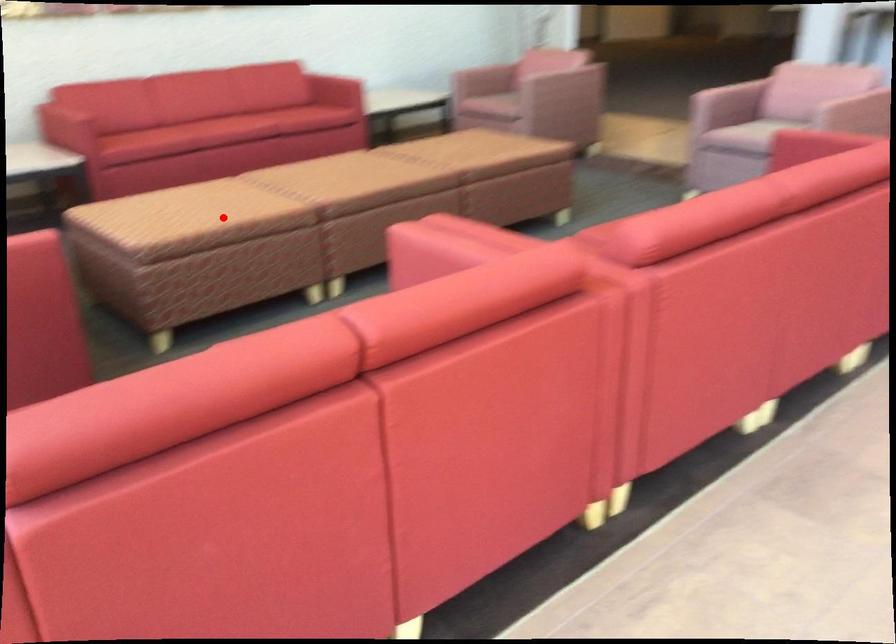
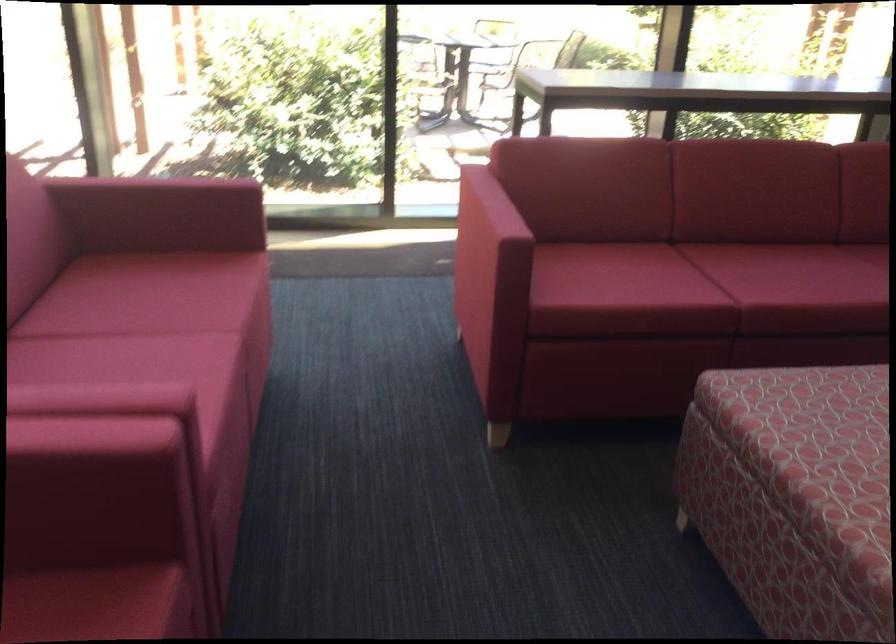
Question: I am providing you with two images of the same scene from different viewpoints. A red point is shown in image1. For the corresponding object point in image2, is it positioned nearer or farther from the camera?

Choices:
 (A) Nearer
 (B) Farther

Answer: (A)